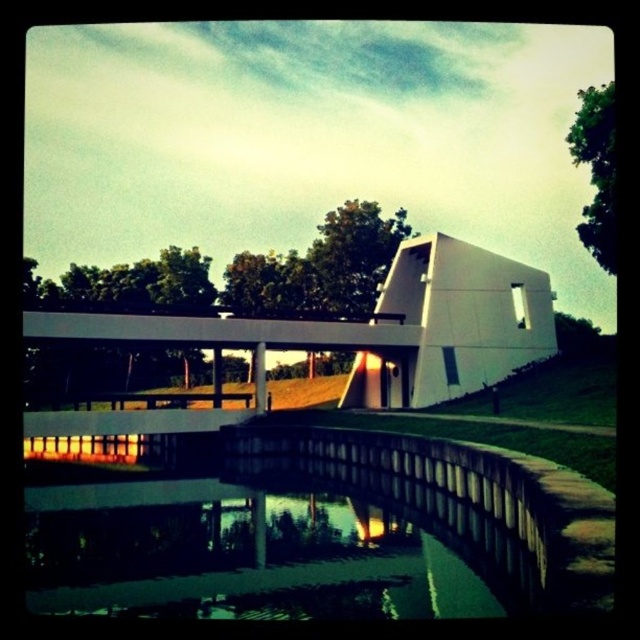
Is green reflective water at lower center bigger than white smooth bridge at center?

Incorrect, green reflective water at lower center is not larger than white smooth bridge at center.

Which is in front, point (465, 602) or point (483, 301)?

Point (465, 602) is more forward.

Between point (460, 584) and point (513, 346), which one is positioned in front?

Positioned in front is point (460, 584).

Find the location of a particular element. The height and width of the screenshot is (640, 640). green reflective water at lower center is located at coordinates (236, 556).